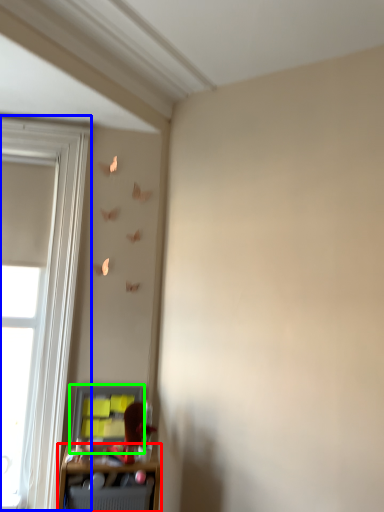
Question: Estimate the real-world distances between objects in this image. Which object is closer to shelf (highlighted by a red box), window (highlighted by a blue box) or cabinet (highlighted by a green box)?

Choices:
 (A) window
 (B) cabinet

Answer: (B)